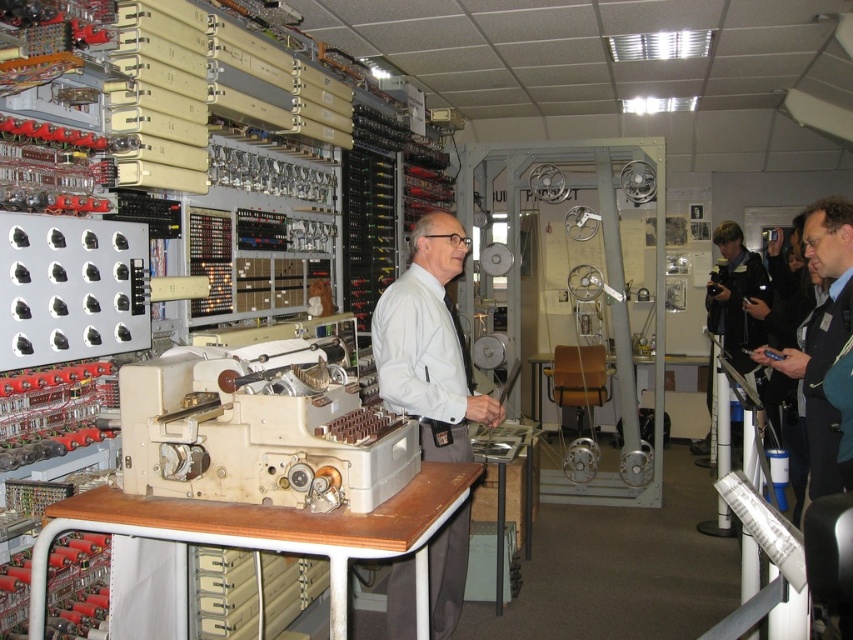
You are a security guard in the museum and need to determine which clothing item is larger between the white matte shirt at center and the dark blue jacket at right. Based on the scene, which one is larger?

The white matte shirt at center is bigger than the dark blue jacket at right.

Looking at this image, you are a security guard in the museum and notice two visitors wearing a white matte shirt at center and a black leather jacket at right. If you are standing at the entrance facing the vintage computer, which visitor is closer to the entrance?

The white matte shirt at center is to the left of the black leather jacket at right. Since the entrance is facing the vintage computer, the visitor wearing the white matte shirt at center is closer to the entrance because they are positioned to the left side of the scene.